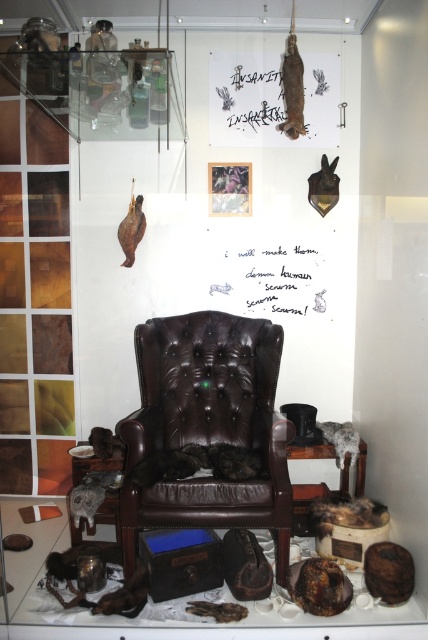
Based on the photo, you are standing in the room and want to hang a small picture on the wall behind the brown leather armchair at center. Is there enough space between the chair and the white paper at center to do this?

The brown leather armchair at center is in front of the white paper at center, so there is space between them. You can hang the picture on the white paper at center behind the chair.

You are an interior designer planning to place a decorative item between the brown leather armchair at center and the white paper at center. Considering their sizes, which object should you place closer to the smaller one to maintain balance?

The white paper at center is smaller in width than the brown leather armchair at center. To maintain balance, place the decorative item closer to the white paper at center so it visually compensates for its smaller size.

You are an interior designer inspecting the room. You notice the brown leather armchair at center and the white paper at center. Which object is closer to the floor?

The brown leather armchair at center is below white paper at center, so the brown leather armchair at center is closer to the floor.